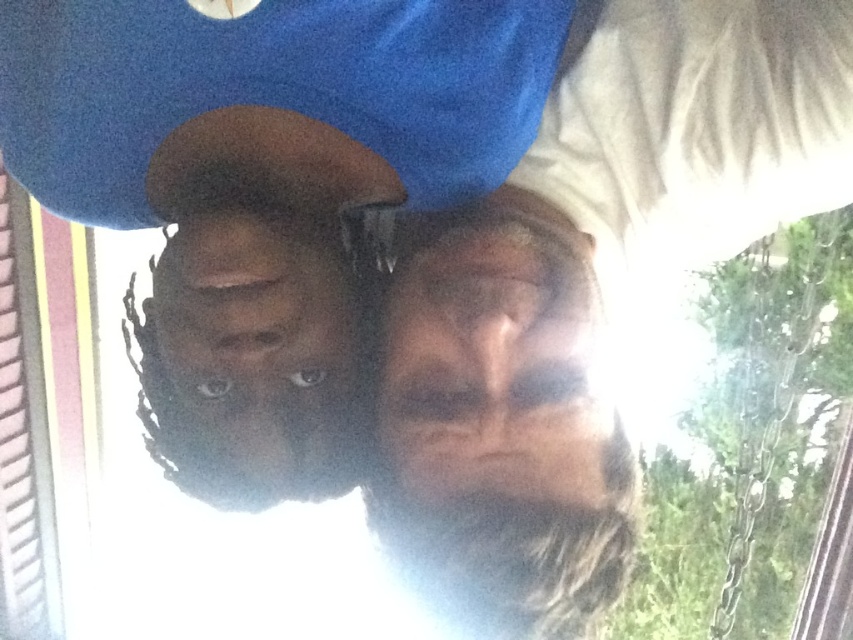
You are taking a selfie and want to ensure both people are in focus. The camera focuses on the point at point (585,292). Which part of the image will be in focus?

The matte blue shirt at upper center is represented by point (585,292), so the camera will focus on the matte blue shirt at upper center.

You are analyzing a photo where two points are marked at coordinates point (740, 20) and point (459, 61). Based on the scene description, which point is closer to the camera?

Point (459, 61) is closer to the camera since it is in front of point (740, 20) according to the description.